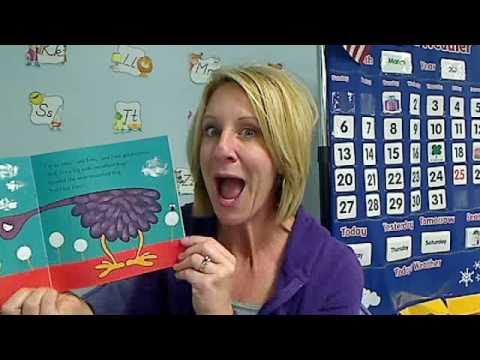
Where is `wall decorations for alphabet letters`? wall decorations for alphabet letters is located at coordinates (131, 119), (48, 113), (42, 52), (126, 56).